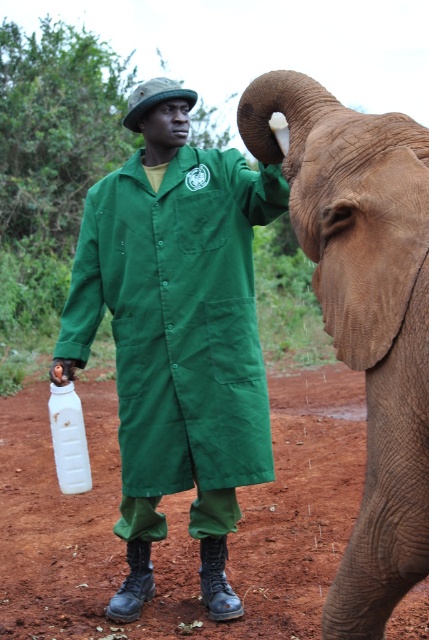
Who is positioned more to the left, green fabric uniform at center or brown textured skin at right?

Positioned to the left is green fabric uniform at center.

Looking at this image, is green fabric uniform at center closer to the viewer compared to brown textured skin at right?

That is False.

Who is more distant from viewer, (157, 88) or (401, 524)?

The point (157, 88) is more distant.

At what (x,y) coordinates should I click in order to perform the action: click on green fabric uniform at center. Please return your answer as a coordinate pair (x, y). Looking at the image, I should click on (177, 333).